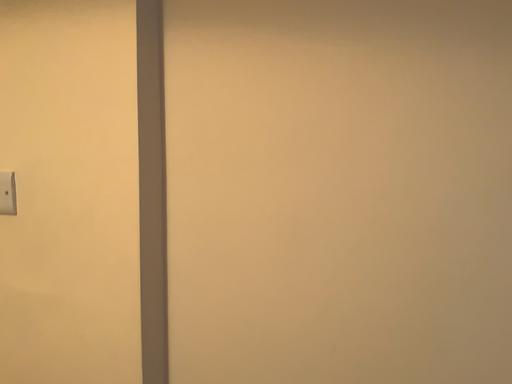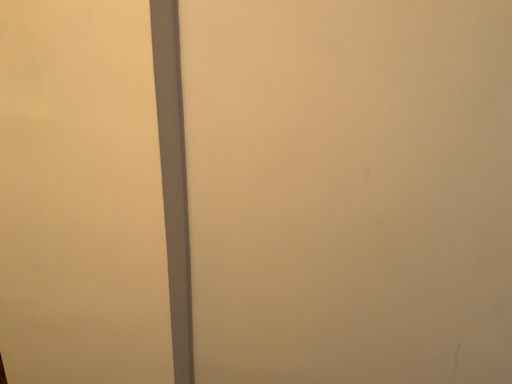
Question: Which way did the camera rotate in the video?

Choices:
 (A) rotated downward
 (B) rotated upward

Answer: (A)